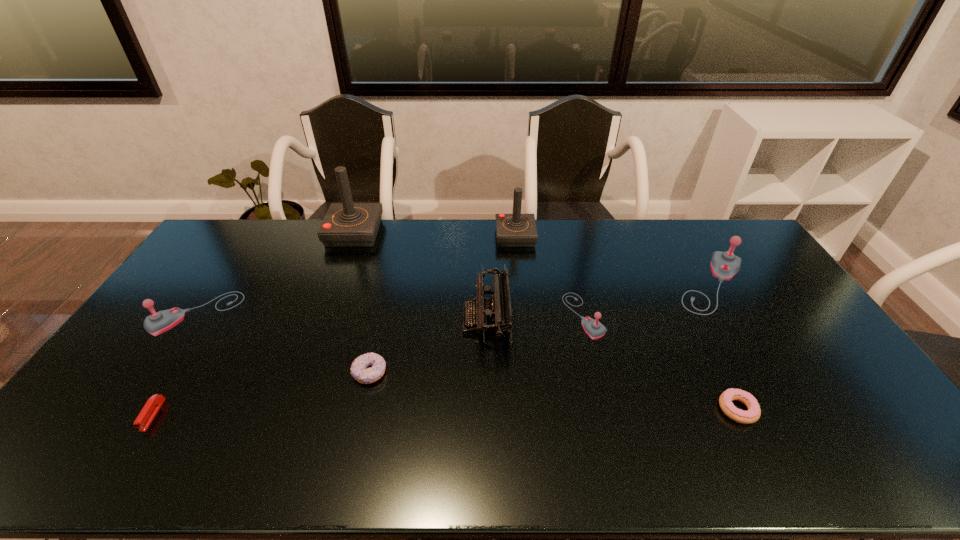
This screenshot has width=960, height=540. What are the coordinates of `the second joystick from left to right` in the screenshot? It's located at click(x=347, y=224).

Locate an element on the screen. the tallest object is located at coordinates (347, 224).

The image size is (960, 540). What are the coordinates of `the smaller red joystick` in the screenshot? It's located at (512, 230).

Where is `the second tallest object`? Image resolution: width=960 pixels, height=540 pixels. the second tallest object is located at coordinates (512, 230).

At what (x,y) coordinates should I click in order to perform the action: click on the third shortest joystick. Please return your answer as a coordinate pair (x, y). The image size is (960, 540). Looking at the image, I should click on [724, 265].

Where is `the biggest gray joystick`? The height and width of the screenshot is (540, 960). the biggest gray joystick is located at coordinates (724, 265).

This screenshot has width=960, height=540. In order to click on typewriter in this screenshot , I will do `click(490, 315)`.

Identify the location of the leftmost gray joystick. This screenshot has height=540, width=960. (158, 322).

Locate an element on the screen. the fourth tallest joystick is located at coordinates (158, 322).

The width and height of the screenshot is (960, 540). In order to click on the third object from right to left in this screenshot , I will do `click(594, 329)`.